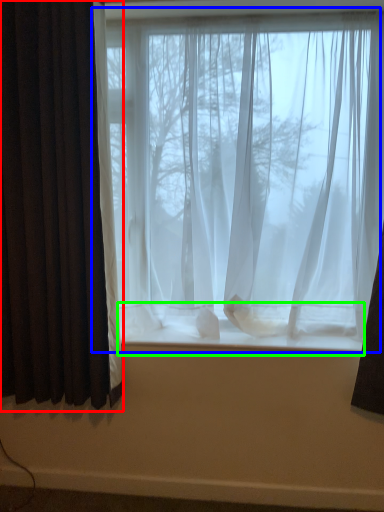
Question: Which object is positioned farthest from curtain (highlighted by a red box)? Select from window (highlighted by a blue box) and window sill (highlighted by a green box).

Choices:
 (A) window
 (B) window sill

Answer: (B)